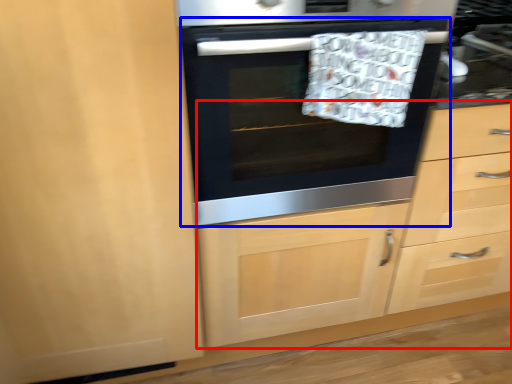
Question: Which object is further to the camera taking this photo, dresser (highlighted by a red box) or oven (highlighted by a blue box)?

Choices:
 (A) dresser
 (B) oven

Answer: (A)